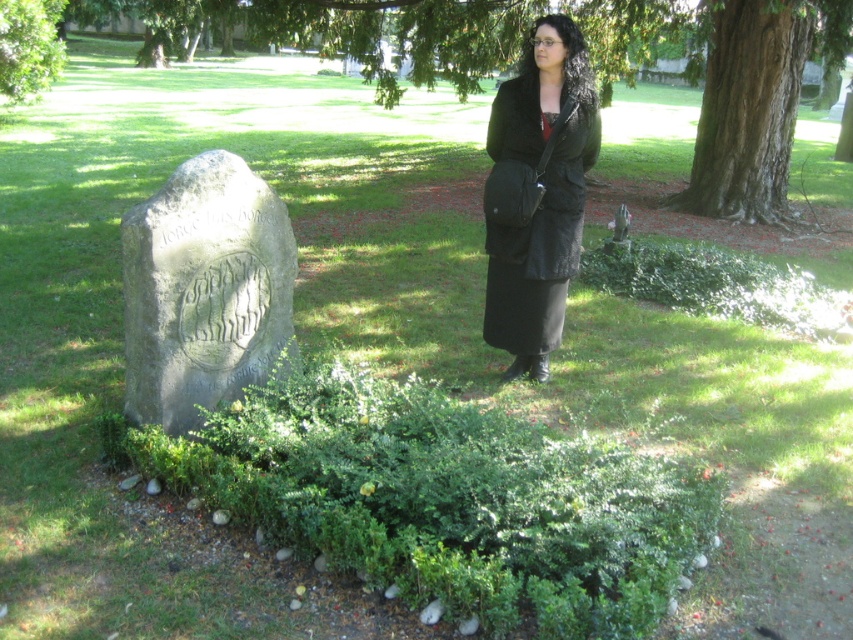
Question: Among these objects, which one is farthest from the camera?

Choices:
 (A) smooth brown bark at upper right
 (B) black leather jacket at center
 (C) gray stone gravestone at left

Answer: (A)

Question: Which of the following is the closest to the observer?

Choices:
 (A) green leafy tree at upper left
 (B) gray stone gravestone at left

Answer: (B)

Question: Is gray stone gravestone at left to the right of smooth brown bark at upper right from the viewer's perspective?

Choices:
 (A) no
 (B) yes

Answer: (A)

Question: Which point is farther to the camera?

Choices:
 (A) black leather jacket at center
 (B) green leafy tree at upper left

Answer: (B)

Question: Is smooth brown bark at upper right smaller than green leafy tree at upper left?

Choices:
 (A) no
 (B) yes

Answer: (A)

Question: Observing the image, what is the correct spatial positioning of black leather jacket at center in reference to smooth brown bark at upper right?

Choices:
 (A) below
 (B) above

Answer: (A)